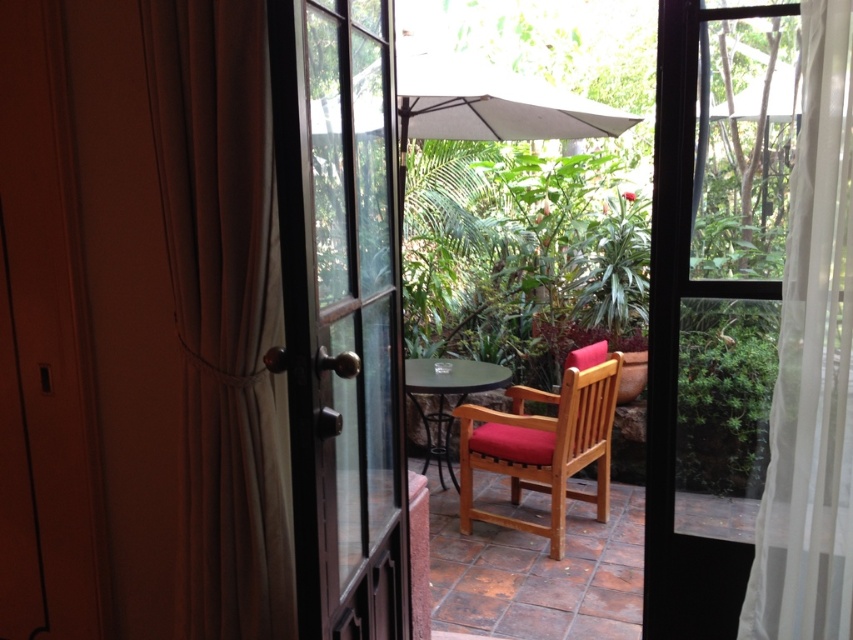
Based on the photo, you are a delivery person carrying a package that is 6 feet long. You need to move it through the space between the brown fabric curtain at left and the teak wood armchair at center. Can you fit the package through that space?

The distance between the brown fabric curtain at left and the teak wood armchair at center is 5.71 feet. Since the package is 6 feet long, it is slightly longer than the available space, so the package cannot fit through that space.

You are a delivery person holding a package that is 18 inches long. You need to place it on the floor between the teak wood armchair at center and the matte black table at center. Is there enough space to lay the package flat without overlapping either object?

The distance between the teak wood armchair at center and the matte black table at center is 16.77 inches. Since the package is 18 inches long, it would not fit between them without overlapping either object.

You are standing at the glass door and want to place a small potted plant exactly halfway between point (310, 460) and point (448, 376) on the patio. Will the plant be closer to the glass door or the far wall?

The plant placed halfway between point (310, 460) and point (448, 376) will be closer to the glass door because point (310, 460) is in front of point (448, 376), so the midpoint is nearer to the door.